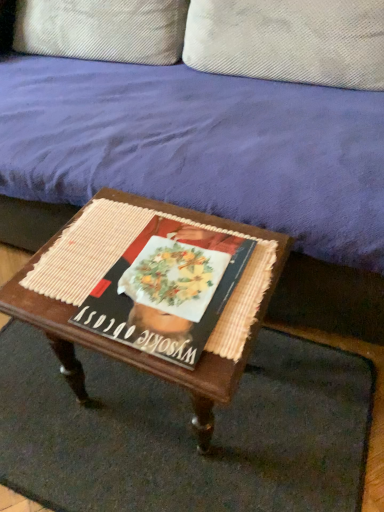
Question: Can you confirm if woven wood table at center is bigger than textured beige pillow at upper center, which ranks as the first pillow in right-to-left order?

Choices:
 (A) no
 (B) yes

Answer: (B)

Question: Can we say woven wood table at center lies outside textured beige pillow at upper center, the 2th pillow positioned from the left?

Choices:
 (A) no
 (B) yes

Answer: (B)

Question: From a real-world perspective, is woven wood table at center positioned under textured beige pillow at upper center, which ranks as the first pillow in right-to-left order, based on gravity?

Choices:
 (A) no
 (B) yes

Answer: (B)

Question: Is woven wood table at center positioned behind textured beige pillow at upper center, which ranks as the first pillow in right-to-left order?

Choices:
 (A) no
 (B) yes

Answer: (A)

Question: Does woven wood table at center have a smaller size compared to textured beige pillow at upper center, the 2th pillow positioned from the left?

Choices:
 (A) yes
 (B) no

Answer: (B)

Question: In terms of width, does velvet purple couch at upper center look wider or thinner when compared to textured beige pillow at upper center, acting as the second pillow starting from the right?

Choices:
 (A) wide
 (B) thin

Answer: (A)

Question: Looking at the image, does velvet purple couch at upper center seem bigger or smaller compared to textured beige pillow at upper center, acting as the second pillow starting from the right?

Choices:
 (A) small
 (B) big

Answer: (B)

Question: From the image's perspective, is velvet purple couch at upper center located above or below textured beige pillow at upper center, acting as the second pillow starting from the right?

Choices:
 (A) above
 (B) below

Answer: (B)

Question: Does point 117,151 appear closer or farther from the camera than point 49,27?

Choices:
 (A) closer
 (B) farther

Answer: (A)

Question: In the image, is woven wood table at center positioned in front of or behind textured beige pillow at upper center, acting as the second pillow starting from the right?

Choices:
 (A) behind
 (B) front

Answer: (B)

Question: In terms of width, does woven wood table at center look wider or thinner when compared to textured beige pillow at upper center, acting as the second pillow starting from the right?

Choices:
 (A) thin
 (B) wide

Answer: (B)

Question: From the image's perspective, is woven wood table at center located above or below textured beige pillow at upper center, acting as the second pillow starting from the right?

Choices:
 (A) below
 (B) above

Answer: (A)

Question: In terms of size, does woven wood table at center appear bigger or smaller than textured beige pillow at upper center, acting as the second pillow starting from the right?

Choices:
 (A) small
 (B) big

Answer: (A)

Question: From the image's perspective, relative to woven mat at center, is textured beige pillow at upper center, acting as the second pillow starting from the right, above or below?

Choices:
 (A) below
 (B) above

Answer: (B)

Question: Considering the positions of textured beige pillow at upper center, which appears as the first pillow when viewed from the left, and woven mat at center in the image, is textured beige pillow at upper center, which appears as the first pillow when viewed from the left, wider or thinner than woven mat at center?

Choices:
 (A) wide
 (B) thin

Answer: (B)